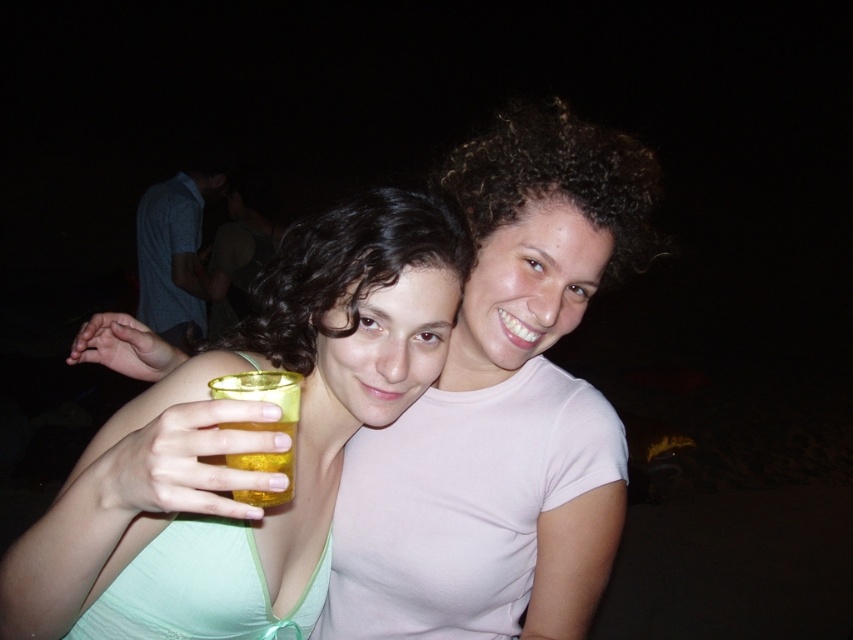
Question: Is blue cotton shirt at upper left to the right of translucent yellow liquid at hand right from the viewer's perspective?

Choices:
 (A) no
 (B) yes

Answer: (A)

Question: Which object is positioned farthest from the translucent plastic cup at center?

Choices:
 (A) translucent yellow liquid at hand right
 (B) matte pink shirt at center
 (C) blue cotton shirt at upper left
 (D) dark curly hair at upper center

Answer: (C)

Question: Which object is the farthest from the translucent plastic cup at center?

Choices:
 (A) blue cotton shirt at upper left
 (B) dark curly hair at upper center
 (C) matte pink shirt at center

Answer: (A)

Question: Does translucent plastic cup at center appear on the left side of dark curly hair at upper center?

Choices:
 (A) no
 (B) yes

Answer: (B)

Question: Does blue cotton shirt at upper left have a smaller size compared to translucent yellow liquid at hand right?

Choices:
 (A) no
 (B) yes

Answer: (A)

Question: Among these objects, which one is nearest to the camera?

Choices:
 (A) translucent yellow liquid at hand right
 (B) dark curly hair at upper center
 (C) blue cotton shirt at upper left

Answer: (A)